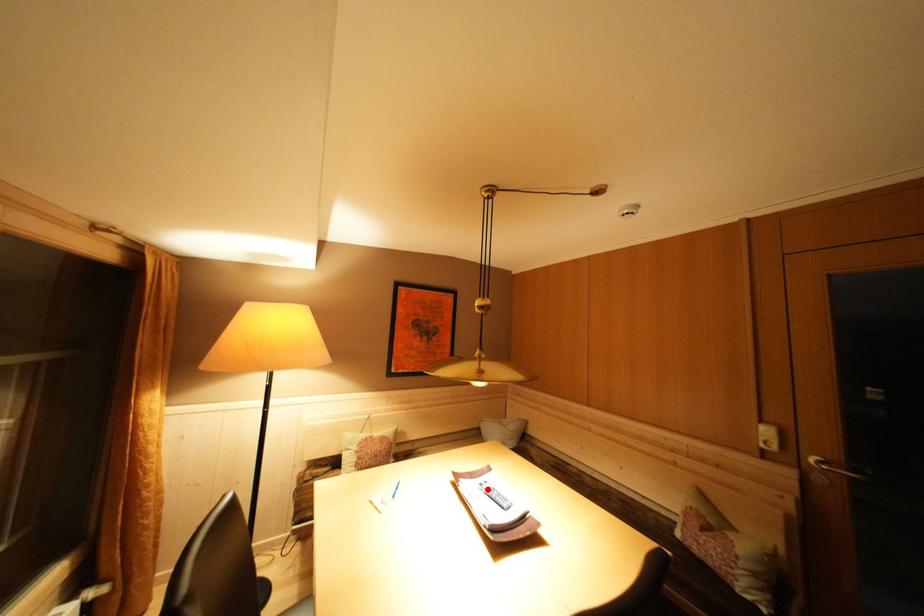
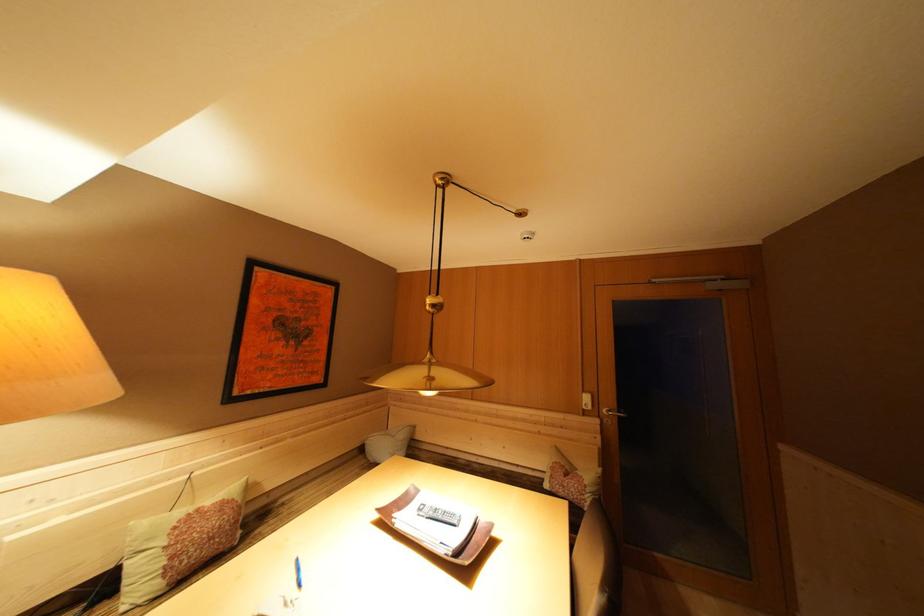
Locate, in the second image, the point that corresponds to the highlighted location in the first image.

(427, 515)